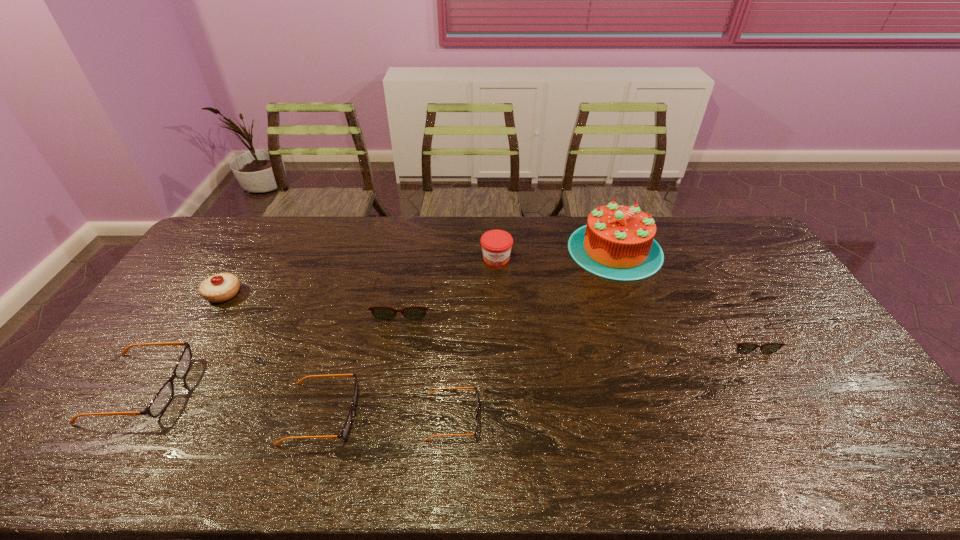
The image size is (960, 540). I want to click on free area in between the beige pastry and the left brown spectacles, so click(314, 299).

Locate an element on the screen. This screenshot has width=960, height=540. free spot between the fifth farthest object and the bigger brown spectacles is located at coordinates (575, 321).

Locate an element on the screen. unoccupied position between the rightmost spectacles and the second spectacles from right to left is located at coordinates (599, 378).

The height and width of the screenshot is (540, 960). What are the coordinates of `free spot between the farthest spectacles and the nearer brown spectacles` in the screenshot? It's located at (575, 321).

This screenshot has height=540, width=960. I want to click on blank region between the fourth object from right to left and the farthest spectacles, so click(428, 360).

Find the location of `free space between the beige pastry and the farther brown spectacles`. free space between the beige pastry and the farther brown spectacles is located at coordinates (314, 299).

Where is `free space between the leftmost black spectacles and the second black spectacles from right to left`? The width and height of the screenshot is (960, 540). free space between the leftmost black spectacles and the second black spectacles from right to left is located at coordinates (231, 401).

This screenshot has height=540, width=960. In order to click on free space between the second black spectacles from left to right and the fifth farthest object in this screenshot , I will do `click(534, 376)`.

The width and height of the screenshot is (960, 540). Find the location of `free space between the fifth farthest object and the farther brown spectacles`. free space between the fifth farthest object and the farther brown spectacles is located at coordinates (575, 321).

Choose which object is the third nearest neighbor to the seventh object from left to right. Please provide its 2D coordinates. Your answer should be formatted as a tuple, i.e. [(x, y)], where the tuple contains the x and y coordinates of a point satisfying the conditions above.

[(381, 313)]